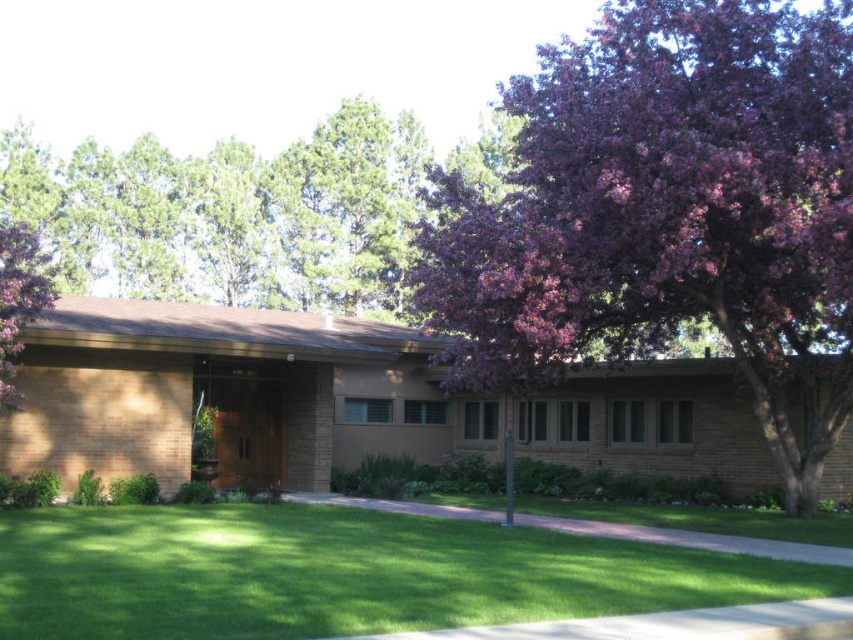
Question: Can you confirm if purple leafy tree at upper right is positioned below green grass at lower center?

Choices:
 (A) no
 (B) yes

Answer: (A)

Question: Among these points, which one is nearest to the camera?

Choices:
 (A) (0, 401)
 (B) (672, 300)
 (C) (299, 230)

Answer: (A)

Question: Among these points, which one is nearest to the camera?

Choices:
 (A) pos(1,404)
 (B) pos(209,170)

Answer: (A)

Question: Is green grass at lower center closer to camera compared to green leafy tree at upper center?

Choices:
 (A) yes
 (B) no

Answer: (A)

Question: Which of the following is the closest to the observer?

Choices:
 (A) green grass at lower center
 (B) green leafy tree at upper center

Answer: (A)

Question: Is green leafy tree at upper center further to camera compared to purple leafy tree at upper left?

Choices:
 (A) yes
 (B) no

Answer: (A)